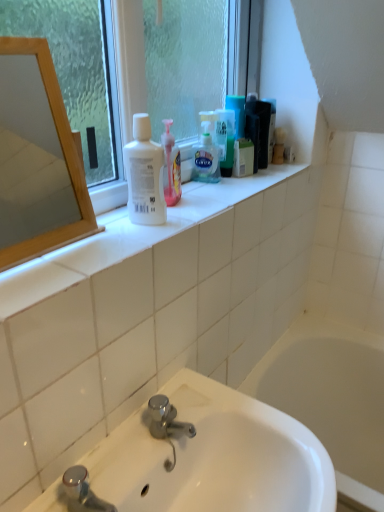
What do you see at coordinates (243, 157) in the screenshot? I see `green matte box at upper center` at bounding box center [243, 157].

What is the approximate width of clear glass window at upper center?

The width of clear glass window at upper center is 4.77 inches.

Image resolution: width=384 pixels, height=512 pixels. Describe the element at coordinates (205, 160) in the screenshot. I see `translucent plastic shaving cream at center` at that location.

Find the location of a particular element. green matte box at upper center is located at coordinates (243, 157).

Which object is thinner, white matte bottle at upper center or clear glass window at upper center?

Thinner between the two is white matte bottle at upper center.

This screenshot has width=384, height=512. Find the location of `cleaning product that appears below the clear glass window at upper center (from a real-world perspective)`. cleaning product that appears below the clear glass window at upper center (from a real-world perspective) is located at coordinates (144, 175).

How different are the orientations of white matte bottle at upper center and clear glass window at upper center in degrees?

0.761 degrees separate the facing orientations of white matte bottle at upper center and clear glass window at upper center.

Is white matte bottle at upper center surrounding clear glass window at upper center?

No, clear glass window at upper center is not surrounded by white matte bottle at upper center.

Who is taller, translucent plastic shaving cream at center or clear glass window at upper center?

Standing taller between the two is clear glass window at upper center.

Considering the sizes of objects translucent plastic shaving cream at center and clear glass window at upper center in the image provided, who is bigger, translucent plastic shaving cream at center or clear glass window at upper center?

clear glass window at upper center is bigger.

From the image's perspective, is translucent plastic shaving cream at center under clear glass window at upper center?

Yes.

Can you confirm if green matte box at upper center is bigger than translucent plastic shaving cream at center?

Actually, green matte box at upper center might be smaller than translucent plastic shaving cream at center.

What's the angular difference between green matte box at upper center and translucent plastic shaving cream at center's facing directions?

The angular difference between green matte box at upper center and translucent plastic shaving cream at center is 0.00454 degrees.

Is green matte box at upper center at the left side of translucent plastic shaving cream at center?

Incorrect, green matte box at upper center is not on the left side of translucent plastic shaving cream at center.

Is point (247, 152) positioned before point (216, 152)?

No, it is behind (216, 152).

In the scene shown: Which object is positioned more to the right, green matte box at upper center or white matte bottle at upper center?

green matte box at upper center is more to the right.

Considering the points (248, 151) and (141, 133), which point is behind, point (248, 151) or point (141, 133)?

The point (248, 151) is behind.

Considering the sizes of objects green matte box at upper center and white matte bottle at upper center in the image provided, who is thinner, green matte box at upper center or white matte bottle at upper center?

green matte box at upper center is thinner.

Identify the location of shaving cream behind the wooden mirror at left. This screenshot has width=384, height=512. (205, 160).

How different are the orientations of translucent plastic shaving cream at center and wooden mirror at left in degrees?

The angle between the facing direction of translucent plastic shaving cream at center and the facing direction of wooden mirror at left is 1.18 degrees.

Is translucent plastic shaving cream at center next to wooden mirror at left?

translucent plastic shaving cream at center and wooden mirror at left are not in contact.

Considering the relative sizes of translucent plastic shaving cream at center and wooden mirror at left in the image provided, is translucent plastic shaving cream at center bigger than wooden mirror at left?

Actually, translucent plastic shaving cream at center might be smaller than wooden mirror at left.

From the image's perspective, is white glossy sink at lower center positioned above or below clear glass window at upper center?

white glossy sink at lower center is situated lower than clear glass window at upper center in the image.

Is white glossy sink at lower center far away from clear glass window at upper center?

No.

This screenshot has width=384, height=512. What are the coordinates of `sink in front of the clear glass window at upper center` in the screenshot? It's located at (214, 457).

Which is more distant, (311, 477) or (213, 36)?

The point (213, 36) is behind.

From a real-world perspective, is clear glass window at upper center positioned under translucent plastic shaving cream at center based on gravity?

Incorrect, from a real-world perspective, clear glass window at upper center is higher than translucent plastic shaving cream at center.

Is clear glass window at upper center bigger or smaller than translucent plastic shaving cream at center?

clear glass window at upper center is bigger than translucent plastic shaving cream at center.

Can you see clear glass window at upper center touching translucent plastic shaving cream at center?

clear glass window at upper center and translucent plastic shaving cream at center are clearly separated.

Considering the sizes of clear glass window at upper center and translucent plastic shaving cream at center in the image, is clear glass window at upper center wider or thinner than translucent plastic shaving cream at center?

Considering their sizes, clear glass window at upper center looks broader than translucent plastic shaving cream at center.

The height and width of the screenshot is (512, 384). Identify the location of cleaning product on the left of clear glass window at upper center. (144, 175).

At what (x,y) coordinates should I click in order to perform the action: click on shaving cream below the clear glass window at upper center (from a real-world perspective). Please return your answer as a coordinate pair (x, y). This screenshot has height=512, width=384. Looking at the image, I should click on (205, 160).

Based on their spatial positions, is white matte bottle at upper center or wooden mirror at left further from green matte box at upper center?

The object further to green matte box at upper center is wooden mirror at left.

Estimate the real-world distances between objects in this image. Which object is closer to clear glass window at upper center, white matte bottle at upper center or white glossy sink at lower center?

The object closer to clear glass window at upper center is white matte bottle at upper center.

From the picture: Looking at the image, which one is located further to white glossy sink at lower center, green matte box at upper center or white matte bottle at upper center?

green matte box at upper center is positioned further to the anchor white glossy sink at lower center.

Estimate the real-world distances between objects in this image. Which object is closer to white matte bottle at upper center, white glossy sink at lower center or translucent plastic shaving cream at center?

translucent plastic shaving cream at center lies closer to white matte bottle at upper center than the other object.

From the image, which object appears to be farther from wooden mirror at left, green matte box at upper center or white matte bottle at upper center?

green matte box at upper center.

When comparing their distances from white glossy sink at lower center, does white matte bottle at upper center or wooden mirror at left seem further?

wooden mirror at left.

When comparing their distances from white matte bottle at upper center, does translucent plastic shaving cream at center or clear glass window at upper center seem further?

The object further to white matte bottle at upper center is clear glass window at upper center.

From the image, which object appears to be nearer to translucent plastic shaving cream at center, white glossy sink at lower center or green matte box at upper center?

Among the two, green matte box at upper center is located nearer to translucent plastic shaving cream at center.

Identify the location of mouthwash between translucent plastic shaving cream at center and white glossy sink at lower center vertically. The image size is (384, 512). (243, 157).

This screenshot has height=512, width=384. In order to click on window located between wooden mirror at left and translucent plastic shaving cream at center in the depth direction in this screenshot , I will do `click(175, 62)`.

You are a GUI agent. You are given a task and a screenshot of the screen. Output one action in this format:
    pyautogui.click(x=<x>, y=<y>)
    Task: Click on the cleaning product positioned between clear glass window at upper center and translucent plastic shaving cream at center from near to far
    The image size is (384, 512).
    Given the screenshot: What is the action you would take?
    pyautogui.click(x=144, y=175)

You are a GUI agent. You are given a task and a screenshot of the screen. Output one action in this format:
    pyautogui.click(x=<x>, y=<y>)
    Task: Click on the mirror between translucent plastic shaving cream at center and white glossy sink at lower center in the vertical direction
    
    Given the screenshot: What is the action you would take?
    pyautogui.click(x=30, y=157)